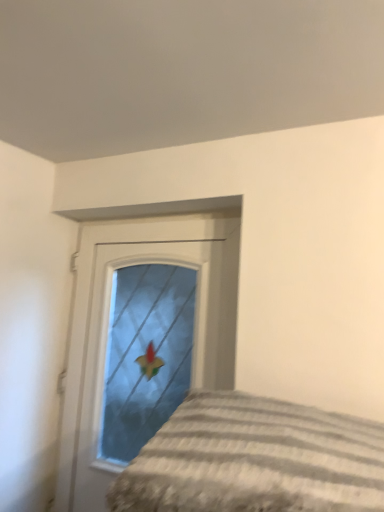
Question: Considering the relative sizes of matte glass door at center and striped fabric bed at lower right in the image provided, is matte glass door at center thinner than striped fabric bed at lower right?

Choices:
 (A) no
 (B) yes

Answer: (B)

Question: Is the depth of matte glass door at center greater than that of striped fabric bed at lower right?

Choices:
 (A) no
 (B) yes

Answer: (B)

Question: Can you confirm if matte glass door at center is taller than striped fabric bed at lower right?

Choices:
 (A) yes
 (B) no

Answer: (A)

Question: Considering the relative positions of matte glass door at center and striped fabric bed at lower right in the image provided, is matte glass door at center to the left of striped fabric bed at lower right from the viewer's perspective?

Choices:
 (A) no
 (B) yes

Answer: (B)

Question: From a real-world perspective, does matte glass door at center stand above striped fabric bed at lower right?

Choices:
 (A) no
 (B) yes

Answer: (B)

Question: Is matte glass door at center oriented towards striped fabric bed at lower right?

Choices:
 (A) yes
 (B) no

Answer: (B)

Question: Can you confirm if striped fabric bed at lower right is positioned to the right of matte glass door at center?

Choices:
 (A) yes
 (B) no

Answer: (A)

Question: From the image's perspective, is striped fabric bed at lower right located beneath matte glass door at center?

Choices:
 (A) no
 (B) yes

Answer: (A)

Question: Considering the relative positions of striped fabric bed at lower right and matte glass door at center in the image provided, is striped fabric bed at lower right to the left of matte glass door at center from the viewer's perspective?

Choices:
 (A) no
 (B) yes

Answer: (A)

Question: Can you see striped fabric bed at lower right touching matte glass door at center?

Choices:
 (A) no
 (B) yes

Answer: (A)

Question: From a real-world perspective, is striped fabric bed at lower right located higher than matte glass door at center?

Choices:
 (A) no
 (B) yes

Answer: (A)

Question: Can you confirm if striped fabric bed at lower right is thinner than matte glass door at center?

Choices:
 (A) yes
 (B) no

Answer: (B)

Question: Is striped fabric bed at lower right to the left or to the right of matte glass door at center in the image?

Choices:
 (A) left
 (B) right

Answer: (B)